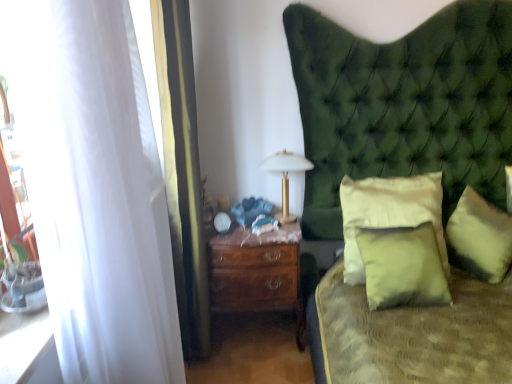
Question: From a real-world perspective, is matte green pillow at center, the 1th pillow from the left, located beneath gold metallic bedside lamp at center?

Choices:
 (A) yes
 (B) no

Answer: (A)

Question: From the image's perspective, is matte green pillow at center, marked as the third pillow in a right-to-left arrangement, under gold metallic bedside lamp at center?

Choices:
 (A) yes
 (B) no

Answer: (A)

Question: Considering the relative sizes of matte green pillow at center, the 1th pillow from the left, and gold metallic bedside lamp at center in the image provided, is matte green pillow at center, the 1th pillow from the left, wider than gold metallic bedside lamp at center?

Choices:
 (A) no
 (B) yes

Answer: (A)

Question: Is matte green pillow at center, the 1th pillow from the left, facing away from gold metallic bedside lamp at center?

Choices:
 (A) no
 (B) yes

Answer: (A)

Question: Are matte green pillow at center, the 1th pillow from the left, and gold metallic bedside lamp at center far apart?

Choices:
 (A) no
 (B) yes

Answer: (A)

Question: Visually, is white sheer curtain at left, which is the first curtain from front to back, positioned to the left or to the right of gold metallic bedside lamp at center?

Choices:
 (A) left
 (B) right

Answer: (A)

Question: In terms of size, does white sheer curtain at left, which is the first curtain from front to back, appear bigger or smaller than gold metallic bedside lamp at center?

Choices:
 (A) big
 (B) small

Answer: (A)

Question: From the image's perspective, relative to gold metallic bedside lamp at center, is white sheer curtain at left, placed as the second curtain when sorted from back to front, above or below?

Choices:
 (A) below
 (B) above

Answer: (A)

Question: From a real-world perspective, is white sheer curtain at left, placed as the second curtain when sorted from back to front, positioned above or below gold metallic bedside lamp at center?

Choices:
 (A) below
 (B) above

Answer: (B)

Question: Considering the positions of matte green pillow at center, the 1th pillow from the left, and soft cream pillow at center, which appears as the 2th pillow when viewed from the right, in the image, is matte green pillow at center, the 1th pillow from the left, taller or shorter than soft cream pillow at center, which appears as the 2th pillow when viewed from the right,?

Choices:
 (A) short
 (B) tall

Answer: (A)

Question: In the image, is matte green pillow at center, marked as the third pillow in a right-to-left arrangement, on the left side or the right side of soft cream pillow at center, which appears as the 2th pillow when viewed from the right?

Choices:
 (A) right
 (B) left

Answer: (B)

Question: Which is correct: matte green pillow at center, the 1th pillow from the left, is inside soft cream pillow at center, which appears as the 2th pillow when viewed from the right, or outside of it?

Choices:
 (A) inside
 (B) outside

Answer: (B)

Question: Relative to soft cream pillow at center, placed as the 2th pillow when sorted from left to right, is matte green pillow at center, the 1th pillow from the left, in front or behind?

Choices:
 (A) behind
 (B) front

Answer: (B)

Question: Is white sheer curtain at left, the first curtain in the back-to-front sequence, inside the boundaries of soft yellow fabric pillow at right, acting as the third pillow starting from the left, or outside?

Choices:
 (A) inside
 (B) outside

Answer: (B)

Question: Based on their positions, is white sheer curtain at left, acting as the 2th curtain starting from the front, located to the left or right of soft yellow fabric pillow at right, acting as the third pillow starting from the left?

Choices:
 (A) right
 (B) left

Answer: (B)